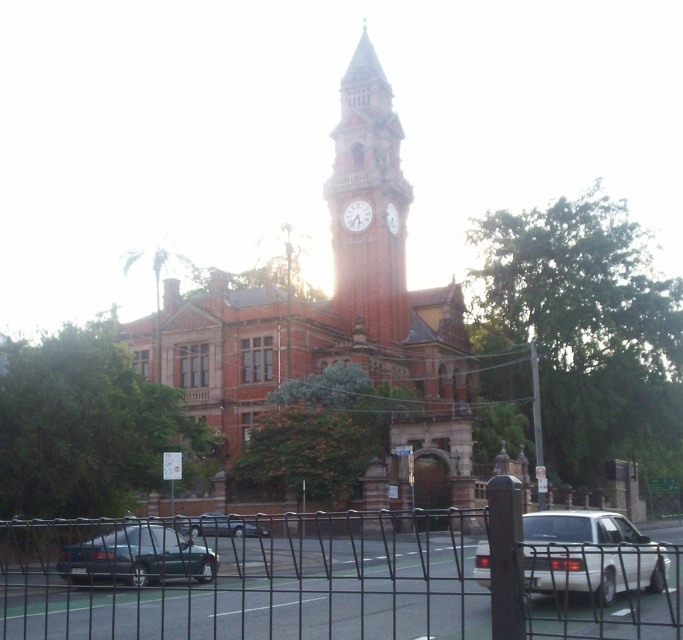
You are standing at the base of the clock tower and want to walk towards the street. There are two points marked on the path ahead of you. One is at point [395,248] and the other is at point [359,211]. Which point is closer to the street?

Point [359,211] is closer to the street because it is in front of point [395,248], which is behind it.

You are standing in front of the historic building and want to take a photo of the white matte clock at center without including the white matte sedan at lower right in the frame. Which direction should you move to ensure the sedan is out of the shot?

Move to the left so that the white matte sedan at lower right is no longer in the frame since it is positioned to the right of the white matte clock at center.